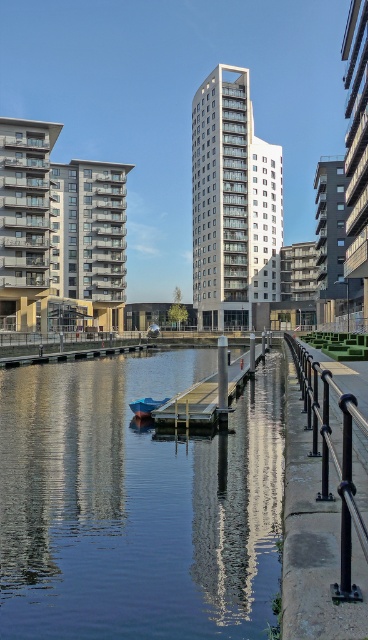
You are standing on the wooden dock at center and want to reach the smooth glass water at center. Which direction should you move to get there?

The smooth glass water at center is positioned under the wooden dock at center, so you are already on the wooden dock at center, which is above the smooth glass water at center. You don not need to move further to reach it.